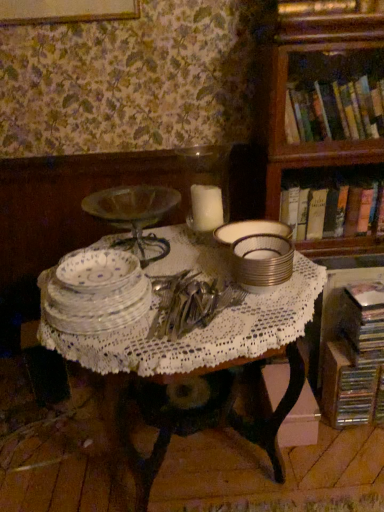
Question: Should I look upward or downward to see white lace tablecloth at center?

Choices:
 (A) down
 (B) up

Answer: (A)

Question: From the image's perspective, is silver metallic stack at center, the second tableware viewed from the left, located above clear glass plates at center, placed as the second tableware when sorted from right to left?

Choices:
 (A) yes
 (B) no

Answer: (A)

Question: Considering the relative positions of silver metallic stack at center, the second tableware viewed from the left, and clear glass plates at center, placed as the second tableware when sorted from right to left, in the image provided, is silver metallic stack at center, the second tableware viewed from the left, to the right of clear glass plates at center, placed as the second tableware when sorted from right to left, from the viewer's perspective?

Choices:
 (A) no
 (B) yes

Answer: (B)

Question: Would you say silver metallic stack at center, the second tableware viewed from the left, is outside clear glass plates at center, placed as the second tableware when sorted from right to left?

Choices:
 (A) yes
 (B) no

Answer: (A)

Question: Can you confirm if silver metallic stack at center, positioned as the 1th tableware in right-to-left order, is wider than clear glass plates at center, positioned as the first tableware in left-to-right order?

Choices:
 (A) no
 (B) yes

Answer: (A)

Question: Does silver metallic stack at center, positioned as the 1th tableware in right-to-left order, lie behind clear glass plates at center, placed as the second tableware when sorted from right to left?

Choices:
 (A) yes
 (B) no

Answer: (A)

Question: Can you confirm if silver metallic stack at center, the second tableware viewed from the left, is thinner than clear glass plates at center, positioned as the first tableware in left-to-right order?

Choices:
 (A) yes
 (B) no

Answer: (A)

Question: Is white lace tablecloth at center at the left side of hardcover book at right, the 2th book positioned from the bottom?

Choices:
 (A) yes
 (B) no

Answer: (A)

Question: Considering the relative sizes of white lace tablecloth at center and hardcover book at right, the 2th book from the top, in the image provided, is white lace tablecloth at center shorter than hardcover book at right, the 2th book from the top,?

Choices:
 (A) yes
 (B) no

Answer: (B)

Question: Is the depth of white lace tablecloth at center greater than that of hardcover book at right, the 2th book from the top?

Choices:
 (A) no
 (B) yes

Answer: (A)

Question: Can you confirm if white lace tablecloth at center is positioned to the right of hardcover book at right, the 2th book positioned from the bottom?

Choices:
 (A) no
 (B) yes

Answer: (A)

Question: Is white lace tablecloth at center in contact with hardcover book at right, the 2th book positioned from the bottom?

Choices:
 (A) yes
 (B) no

Answer: (B)

Question: Does white lace tablecloth at center contain hardcover book at right, the 2th book from the top?

Choices:
 (A) no
 (B) yes

Answer: (A)

Question: From the image's perspective, is hardcover books at upper right, the 3th book from the bottom, located above silver metallic stack at center, the second tableware viewed from the left?

Choices:
 (A) yes
 (B) no

Answer: (A)